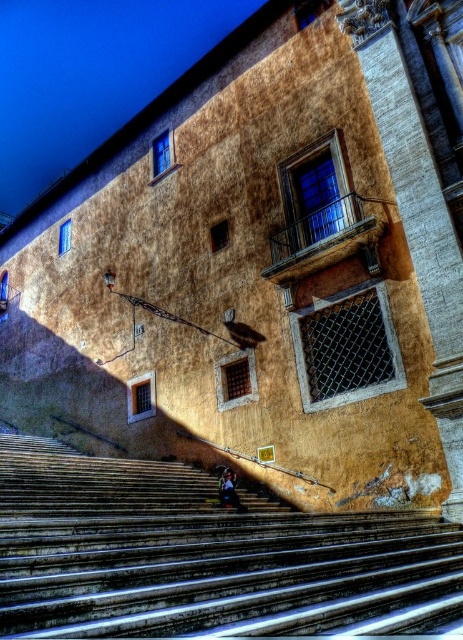
Question: Does smooth concrete stairs at center have a larger size compared to dark blue fabric at center?

Choices:
 (A) no
 (B) yes

Answer: (B)

Question: Is smooth concrete stairs at center further to the viewer compared to dark blue fabric at center?

Choices:
 (A) yes
 (B) no

Answer: (B)

Question: Which point is farther from the camera taking this photo?

Choices:
 (A) [x=244, y=509]
 (B) [x=143, y=604]

Answer: (A)

Question: Among these objects, which one is nearest to the camera?

Choices:
 (A) dark blue fabric at center
 (B) smooth concrete stairs at center

Answer: (B)

Question: Does smooth concrete stairs at center appear on the left side of dark blue fabric at center?

Choices:
 (A) no
 (B) yes

Answer: (B)

Question: Which object is closer to the camera taking this photo?

Choices:
 (A) smooth concrete stairs at center
 (B) dark blue fabric at center

Answer: (A)